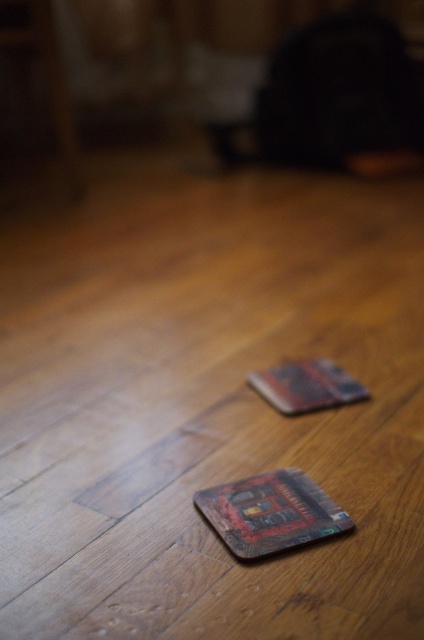
You are arranging items on a wooden floor and have a wooden coaster at center and a wooden textured card at center. Which item is closer to the floor?

The wooden coaster at center is closer to the floor since it is located below the wooden textured card at center.

You are arranging items on a wooden floor and have both the wooden coaster at center and the wooden textured card at center. Which item takes up more area on the floor?

The wooden textured card at center takes up more area than the wooden coaster at center since the wooden coaster at center occupies less space than the wooden textured card at center.

In the scene shown: You are holding a small toy car that is 12 inches long. You want to place it on the wooden coaster at center. Can the toy car fit on the coaster if the coaster is 36.53 inches from you?

The wooden coaster at center is 36.53 inches from the viewer. Since the toy car is 12 inches long, it can fit on the coaster as long as the coaster is large enough to accommodate the car. However, the distance from the viewer does not affect the coaster size. Please check the coaster size for confirmation.